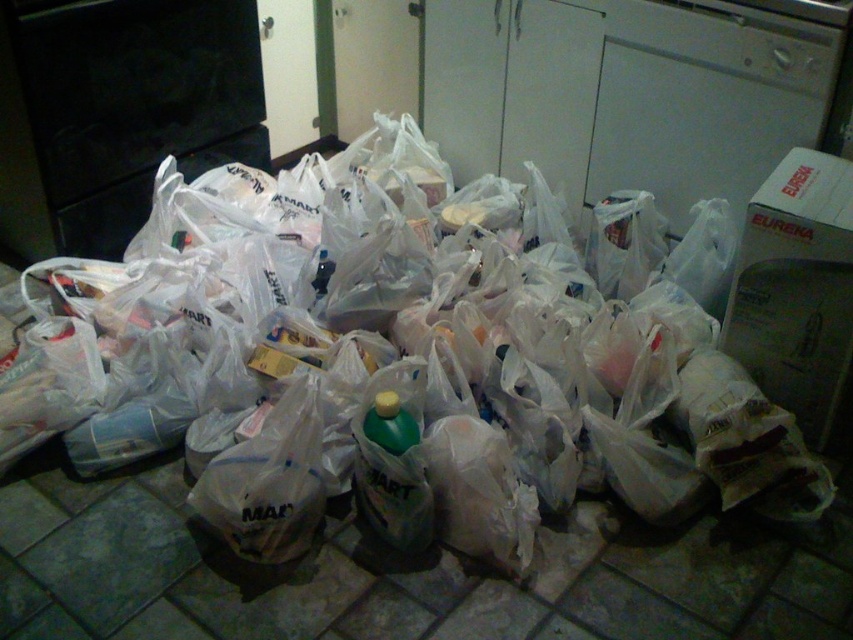
Who is more forward, (160, 29) or (372, 452)?

Point (372, 452)

Does point (252, 61) come farther from viewer compared to point (399, 522)?

Yes.

Is point (90, 200) positioned after point (381, 433)?

That is True.

Where is `black glossy oven at upper left`? black glossy oven at upper left is located at coordinates (117, 112).

Between transparent plastic bags at center and green plastic bottle at center, which one appears on the right side from the viewer's perspective?

From the viewer's perspective, green plastic bottle at center appears more on the right side.

Is point (78, 424) in front of point (360, 492)?

No, it is behind (360, 492).

You are a GUI agent. You are given a task and a screenshot of the screen. Output one action in this format:
    pyautogui.click(x=<x>, y=<y>)
    Task: Click on the transparent plastic bags at center
    This screenshot has height=640, width=853.
    Given the screenshot: What is the action you would take?
    pyautogui.click(x=387, y=362)

Which is more to the left, transparent plastic bags at center or black glossy oven at upper left?

black glossy oven at upper left

Does transparent plastic bags at center come in front of black glossy oven at upper left?

Yes, it is in front of black glossy oven at upper left.

Is point (329, 476) farther from camera compared to point (126, 29)?

No.

This screenshot has width=853, height=640. In order to click on transparent plastic bags at center in this screenshot , I will do `click(387, 362)`.